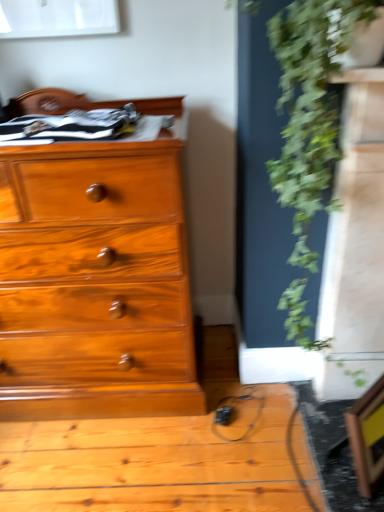
In order to face green leafy plant at right, should I rotate leftwards or rightwards?

Answer: Rotate your view right by about 14.410°.

Find the location of `green leafy plant at right`. green leafy plant at right is located at coordinates (306, 133).

What do you see at coordinates (306, 133) in the screenshot? This screenshot has width=384, height=512. I see `green leafy plant at right` at bounding box center [306, 133].

Locate an element on the screen. green leafy plant at right is located at coordinates (306, 133).